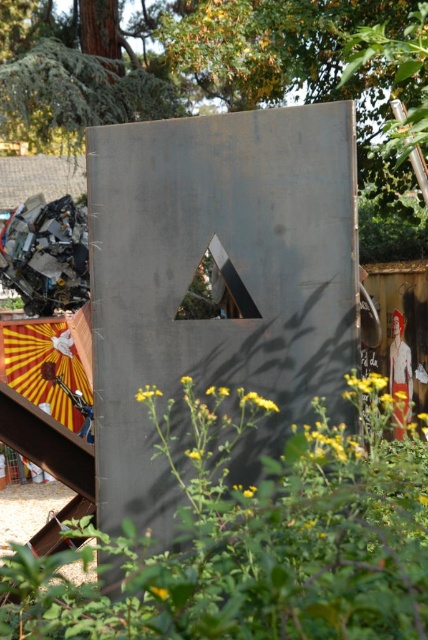
Question: Is green matte plant at center positioned behind yellow striped fabric umbrella at lower left?

Choices:
 (A) no
 (B) yes

Answer: (A)

Question: Observing the image, what is the correct spatial positioning of yellow striped fabric umbrella at lower left in reference to white matte dress at right?

Choices:
 (A) below
 (B) above

Answer: (B)

Question: Does green matte plant at center have a smaller size compared to white matte dress at right?

Choices:
 (A) no
 (B) yes

Answer: (A)

Question: Which of these objects is positioned farthest from the yellow striped fabric umbrella at lower left?

Choices:
 (A) white matte dress at right
 (B) green matte plant at center

Answer: (B)

Question: Which is farther from the yellow striped fabric umbrella at lower left?

Choices:
 (A) white matte dress at right
 (B) green matte plant at center

Answer: (B)

Question: Which of the following is the farthest from the observer?

Choices:
 (A) yellow striped fabric umbrella at lower left
 (B) white matte dress at right
 (C) green matte plant at center

Answer: (A)